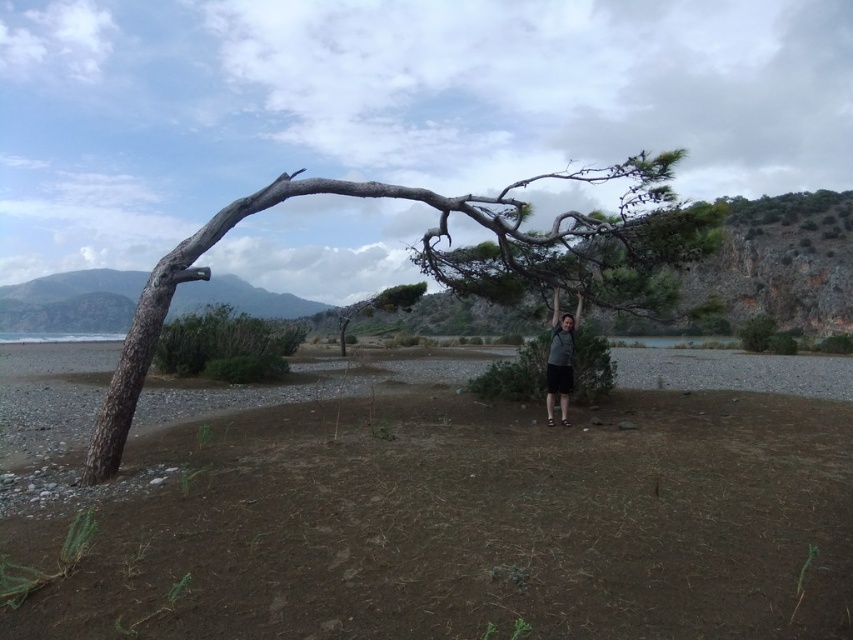
You are standing in the outdoor scene and want to move from the gray bark tree at center to the dark gray fabric shirt at center. Which direction should you move to get closer to the shirt?

To move from the gray bark tree at center to the dark gray fabric shirt at center, you should move to the right since the tree is to the left of the shirt.

You are standing at the origin point in the scene. Which direction should you move to reach the gray bark tree at center?

The gray bark tree at center is located at point (437,260), so you should move northeast to reach it.